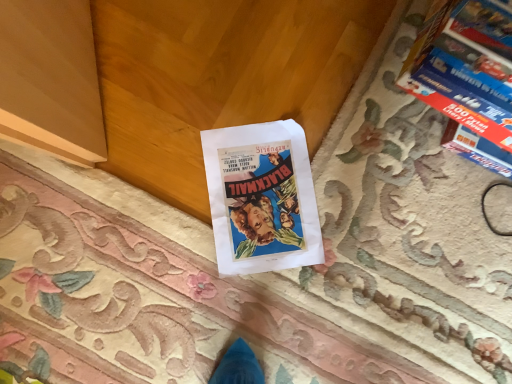
Where is `empty space that is in between blue glossy book at upper right and vintage paper poster at center`? Image resolution: width=512 pixels, height=384 pixels. empty space that is in between blue glossy book at upper right and vintage paper poster at center is located at coordinates (365, 151).